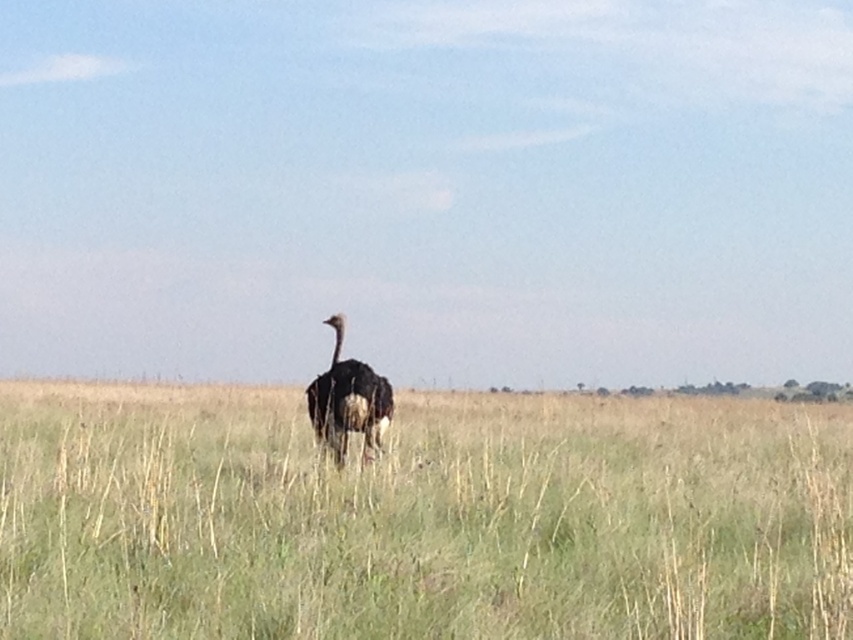
Is point (438, 394) positioned after point (328, 406)?

Yes, it is behind point (328, 406).

Who is positioned more to the left, green grass at center or dark brown feathers at center?

From the viewer's perspective, dark brown feathers at center appears more on the left side.

Is point (525, 621) closer to viewer compared to point (380, 449)?

Yes, it is in front of point (380, 449).

Find the location of `green grass at center`. green grass at center is located at coordinates (421, 516).